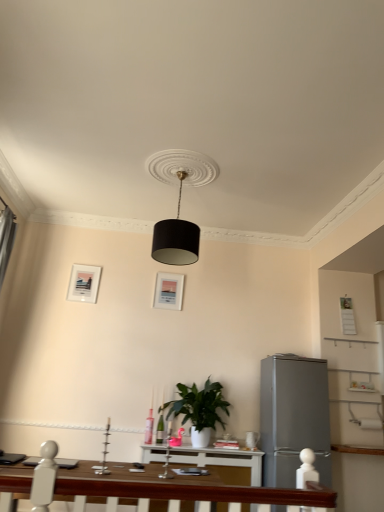
Question: Does satin silver refrigerator at right appear on the right side of green matte plant at center?

Choices:
 (A) yes
 (B) no

Answer: (A)

Question: From the image's perspective, is satin silver refrigerator at right below green matte plant at center?

Choices:
 (A) no
 (B) yes

Answer: (B)

Question: Is satin silver refrigerator at right at the left side of green matte plant at center?

Choices:
 (A) no
 (B) yes

Answer: (A)

Question: From the image's perspective, would you say satin silver refrigerator at right is positioned over green matte plant at center?

Choices:
 (A) no
 (B) yes

Answer: (A)

Question: Is satin silver refrigerator at right wider than green matte plant at center?

Choices:
 (A) yes
 (B) no

Answer: (A)

Question: From a real-world perspective, is black matte lampshade at center above or below white matte picture frame at center, the second picture frame when ordered from left to right?

Choices:
 (A) below
 (B) above

Answer: (B)

Question: Is black matte lampshade at center to the left or to the right of white matte picture frame at center, the second picture frame when ordered from left to right, in the image?

Choices:
 (A) right
 (B) left

Answer: (A)

Question: From the image's perspective, is black matte lampshade at center located above or below white matte picture frame at center, the second picture frame when ordered from left to right?

Choices:
 (A) below
 (B) above

Answer: (B)

Question: Is black matte lampshade at center situated inside white matte picture frame at center, the second picture frame when ordered from left to right, or outside?

Choices:
 (A) outside
 (B) inside

Answer: (A)

Question: Is point (183, 422) closer or farther from the camera than point (155, 287)?

Choices:
 (A) farther
 (B) closer

Answer: (B)

Question: Looking at the image, does green matte plant at center seem bigger or smaller compared to white matte picture frame at center, the second picture frame when ordered from left to right?

Choices:
 (A) small
 (B) big

Answer: (B)

Question: Is green matte plant at center taller or shorter than white matte picture frame at center, positioned as the first picture frame in right-to-left order?

Choices:
 (A) short
 (B) tall

Answer: (B)

Question: Is green matte plant at center inside the boundaries of white matte picture frame at center, positioned as the first picture frame in right-to-left order, or outside?

Choices:
 (A) outside
 (B) inside

Answer: (A)

Question: Does point (99, 266) appear closer or farther from the camera than point (201, 432)?

Choices:
 (A) closer
 (B) farther

Answer: (B)

Question: Is matte white picture frame at upper left, arranged as the first picture frame when viewed from the left, wider or thinner than green matte plant at center?

Choices:
 (A) wide
 (B) thin

Answer: (B)